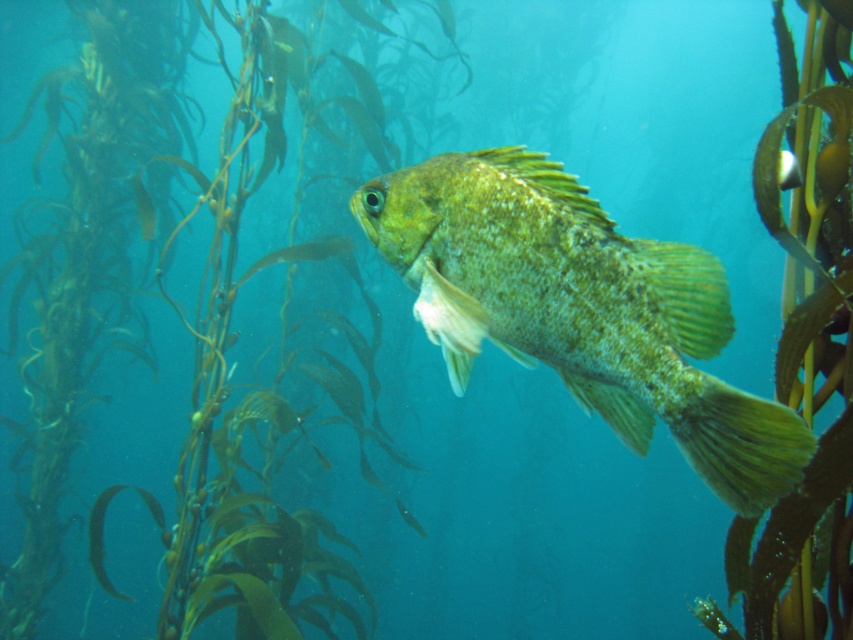
Question: Does green textured fish at center appear on the right side of green leafy plant at center?

Choices:
 (A) yes
 (B) no

Answer: (B)

Question: Which object is closer to the camera taking this photo?

Choices:
 (A) green leafy plant at center
 (B) green textured fish at center

Answer: (B)

Question: Which point appears closest to the camera in this image?

Choices:
 (A) (654, 396)
 (B) (830, 35)

Answer: (A)

Question: Which point is farther to the camera?

Choices:
 (A) green leafy plant at center
 (B) green textured fish at center

Answer: (A)

Question: Is green textured fish at center positioned in front of green leafy plant at center?

Choices:
 (A) no
 (B) yes

Answer: (B)

Question: Is green textured fish at center below green leafy plant at center?

Choices:
 (A) no
 (B) yes

Answer: (A)